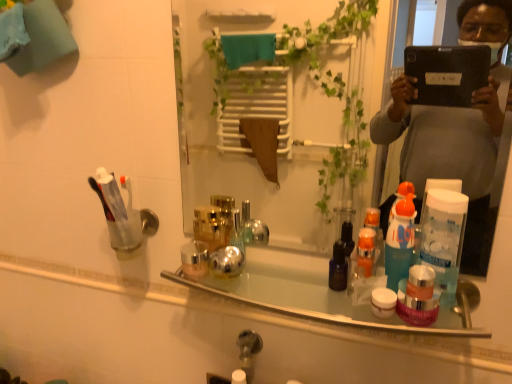
Where is `free space above shiny metallic bottles at center (from a real-world perspective)`? This screenshot has width=512, height=384. free space above shiny metallic bottles at center (from a real-world perspective) is located at coordinates (303, 288).